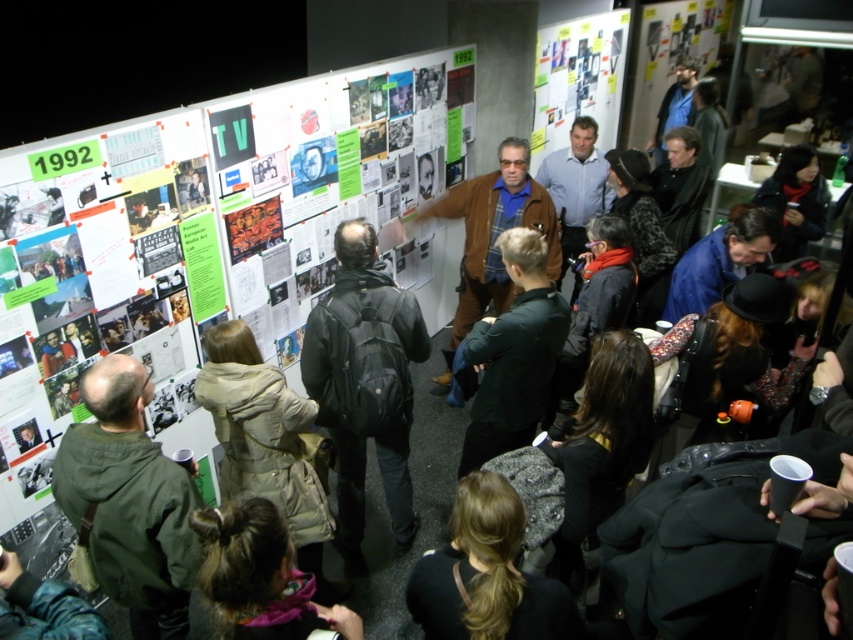
Question: Which of the following is the closest to the observer?

Choices:
 (A) dark brown hair at lower center
 (B) black matte backpack at center
 (C) dark green jacket at center
 (D) brown leather jacket at center

Answer: (A)

Question: Is green paper poster at upper left wider than dark green jacket at center?

Choices:
 (A) yes
 (B) no

Answer: (A)

Question: Is dark brown hair at center positioned in front of dark brown hair at lower center?

Choices:
 (A) yes
 (B) no

Answer: (B)

Question: Which object is positioned farthest from the dark brown hair at lower center?

Choices:
 (A) dark brown hair at center
 (B) brown leather jacket at center

Answer: (B)

Question: Which of the following is the closest to the observer?

Choices:
 (A) green paper poster at upper left
 (B) dark green jacket at center
 (C) green fabric jacket at lower left

Answer: (C)

Question: Is black matte backpack at center behind dark green jacket at center?

Choices:
 (A) no
 (B) yes

Answer: (A)